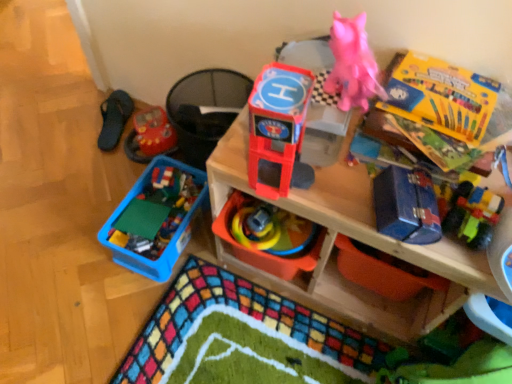
Locate an element on the screen. The image size is (512, 384). free spot below yellow cardboard box at upper right, which appears as the third storage box when ordered from the bottom (from a real-world perspective) is located at coordinates (443, 94).